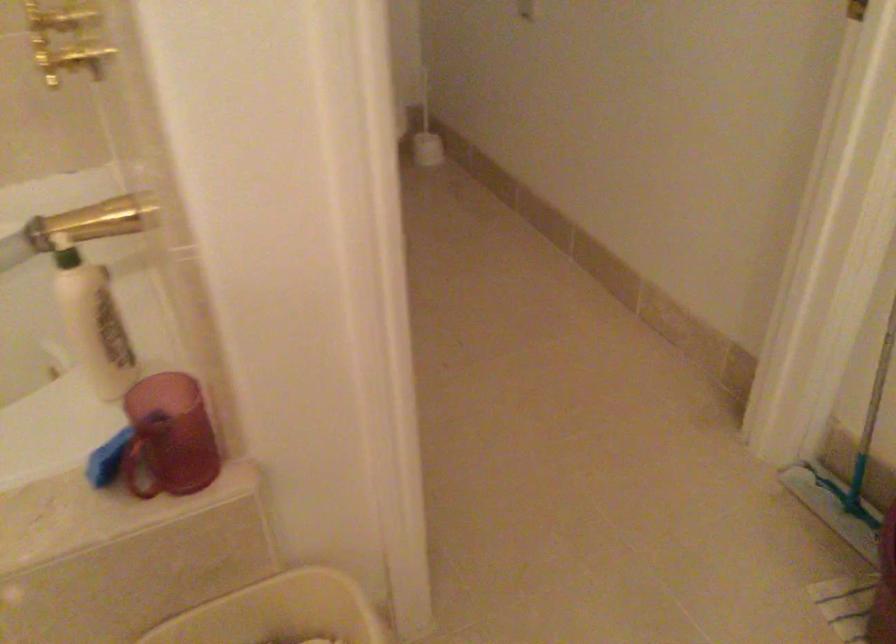
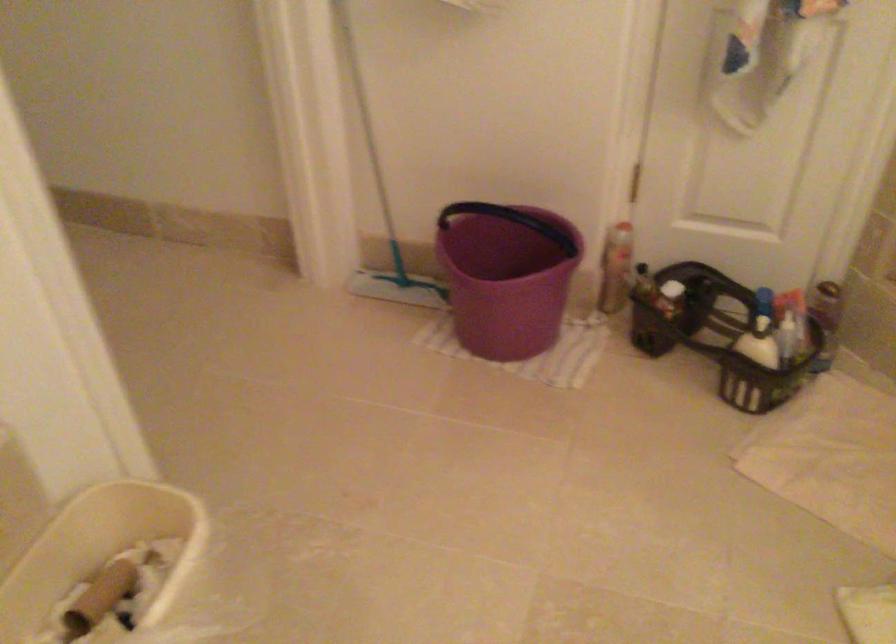
Question: The first image is from the beginning of the video and the second image is from the end. How did the camera likely rotate when shooting the video?

Choices:
 (A) Left
 (B) Right
 (C) Up
 (D) Down

Answer: (B)